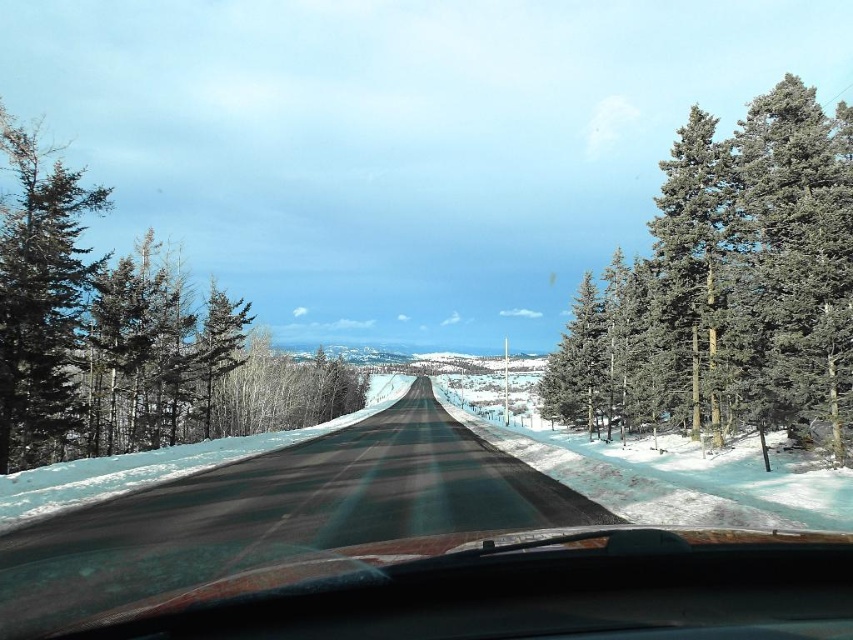
Between green textured pine tree at left and asphalt road at center, which one has less height?

asphalt road at center is shorter.

Between green textured pine tree at left and asphalt road at center, which one appears on the right side from the viewer's perspective?

asphalt road at center

Between point (22, 454) and point (20, 625), which one is positioned in front?

Point (20, 625) is in front.

Where is `green textured pine tree at left`? The width and height of the screenshot is (853, 640). green textured pine tree at left is located at coordinates 126,336.

Is green textured pine trees at right behind green matte tree at left?

No, green textured pine trees at right is in front of green matte tree at left.

Which is behind, point (808, 161) or point (38, 273)?

Positioned behind is point (38, 273).

Where is `green textured pine trees at right`? green textured pine trees at right is located at coordinates (727, 288).

This screenshot has height=640, width=853. What do you see at coordinates (276, 515) in the screenshot?
I see `asphalt road at center` at bounding box center [276, 515].

Is asphalt road at center bigger than green matte tree at left?

Incorrect, asphalt road at center is not larger than green matte tree at left.

Who is more forward, (115, 577) or (39, 387)?

Point (115, 577) is more forward.

The width and height of the screenshot is (853, 640). What are the coordinates of `asphalt road at center` in the screenshot? It's located at (276, 515).